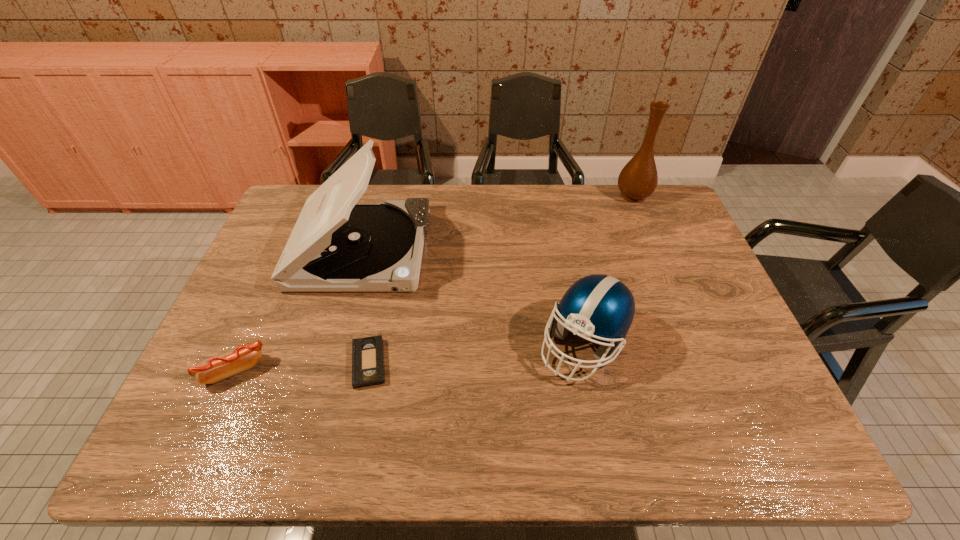
Identify the location of vacant area that lies between the football helmet and the second shortest object. This screenshot has width=960, height=540. (409, 357).

You are a GUI agent. You are given a task and a screenshot of the screen. Output one action in this format:
    pyautogui.click(x=<x>, y=<y>)
    Task: Click on the free space between the second shortest object and the football helmet
    
    Given the screenshot: What is the action you would take?
    pyautogui.click(x=409, y=357)

Point out which object is positioned as the third nearest to the shortest object. Please provide its 2D coordinates. Your answer should be formatted as a tuple, i.e. [(x, y)], where the tuple contains the x and y coordinates of a point satisfying the conditions above.

[(601, 307)]

Point out which object is positioned as the third nearest to the shortest object. Please provide its 2D coordinates. Your answer should be formatted as a tuple, i.e. [(x, y)], where the tuple contains the x and y coordinates of a point satisfying the conditions above.

[(601, 307)]

Find the location of a particular element. Image resolution: width=960 pixels, height=540 pixels. blank area in the image that satisfies the following two spatial constraints: 1. on the back side of the videotape; 2. on the left side of the vase is located at coordinates (403, 195).

Where is `free space that satisfies the following two spatial constraints: 1. on the control panel of the second farthest object; 2. on the right side of the videotape`? free space that satisfies the following two spatial constraints: 1. on the control panel of the second farthest object; 2. on the right side of the videotape is located at coordinates [x=329, y=363].

Locate an element on the screen. The width and height of the screenshot is (960, 540). vacant area that satisfies the following two spatial constraints: 1. on the control panel of the shortest object; 2. on the left side of the CD player is located at coordinates (329, 363).

Locate an element on the screen. The height and width of the screenshot is (540, 960). free point that satisfies the following two spatial constraints: 1. on the control panel of the fourth nearest object; 2. on the left side of the videotape is located at coordinates (329, 363).